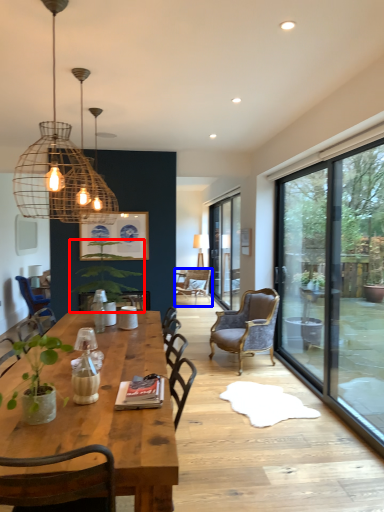
Question: Which of the following is the closest to the observer, houseplant (highlighted by a red box) or chair (highlighted by a blue box)?

Choices:
 (A) houseplant
 (B) chair

Answer: (A)